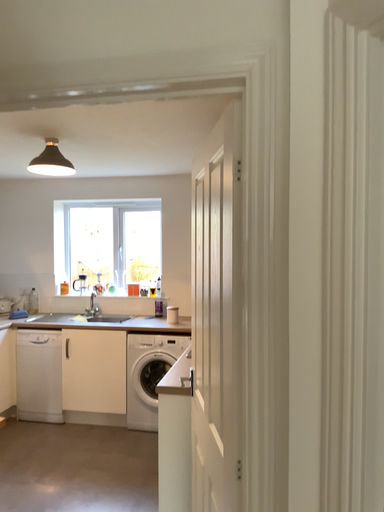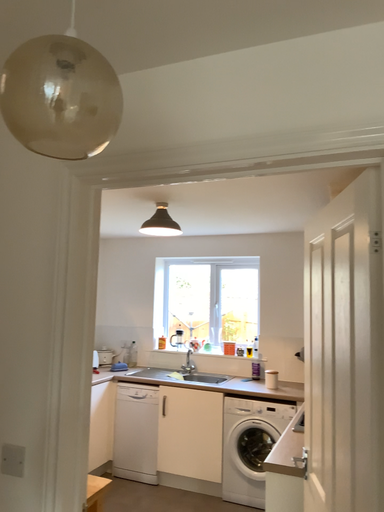
Question: Which way did the camera rotate in the video?

Choices:
 (A) rotated left
 (B) rotated right

Answer: (A)